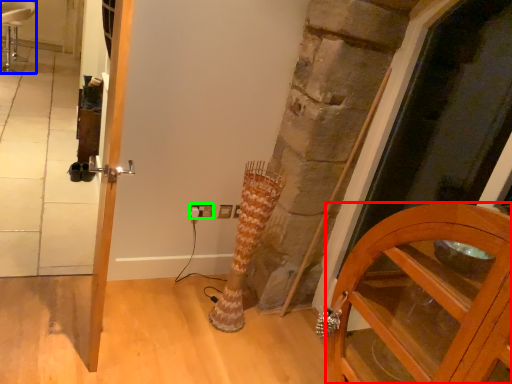
Question: Based on their relative distances, which object is nearer to cabinetry (highlighted by a red box)? Choose from chair (highlighted by a blue box) and electric outlet (highlighted by a green box).

Choices:
 (A) chair
 (B) electric outlet

Answer: (B)